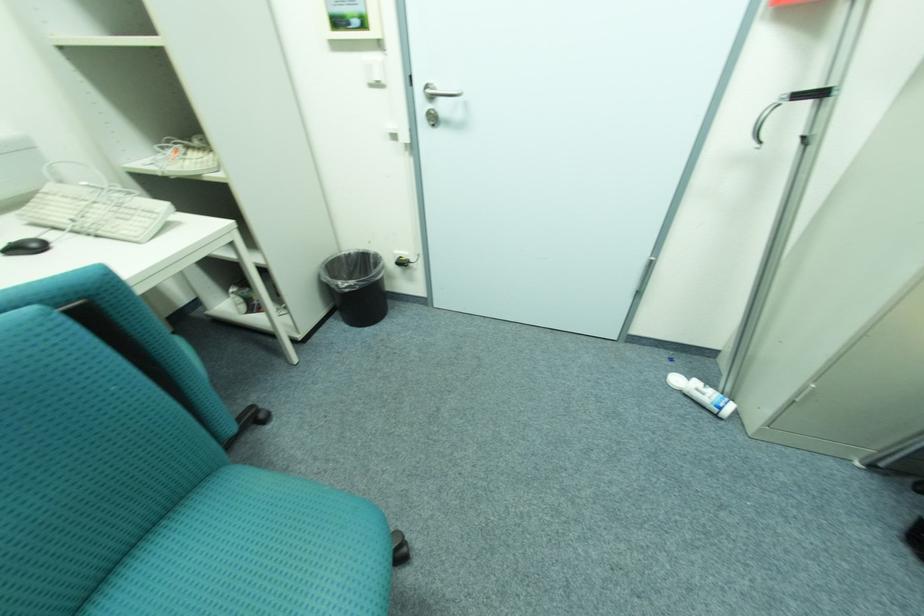
The location [25,246] corresponds to which object?

It refers to a black computer mouse.